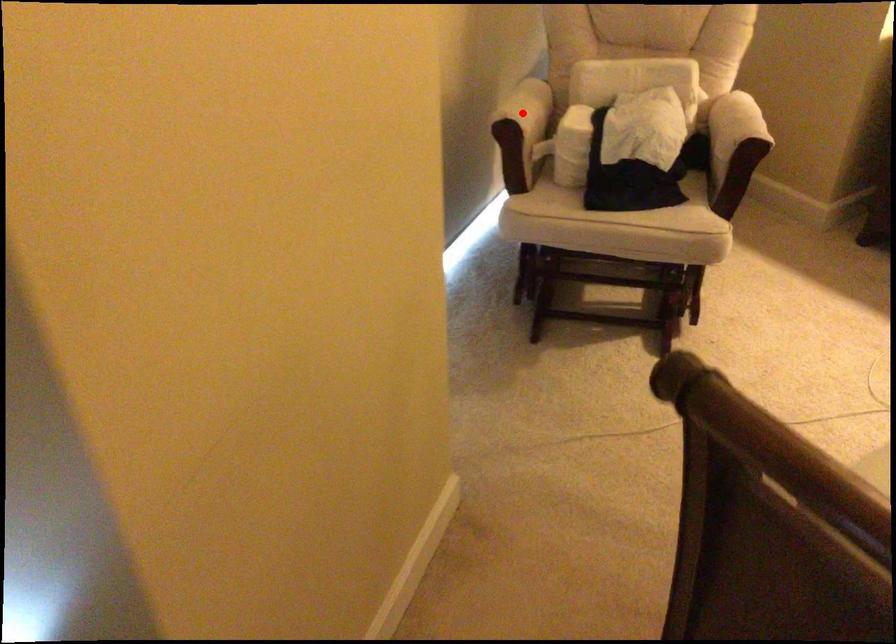
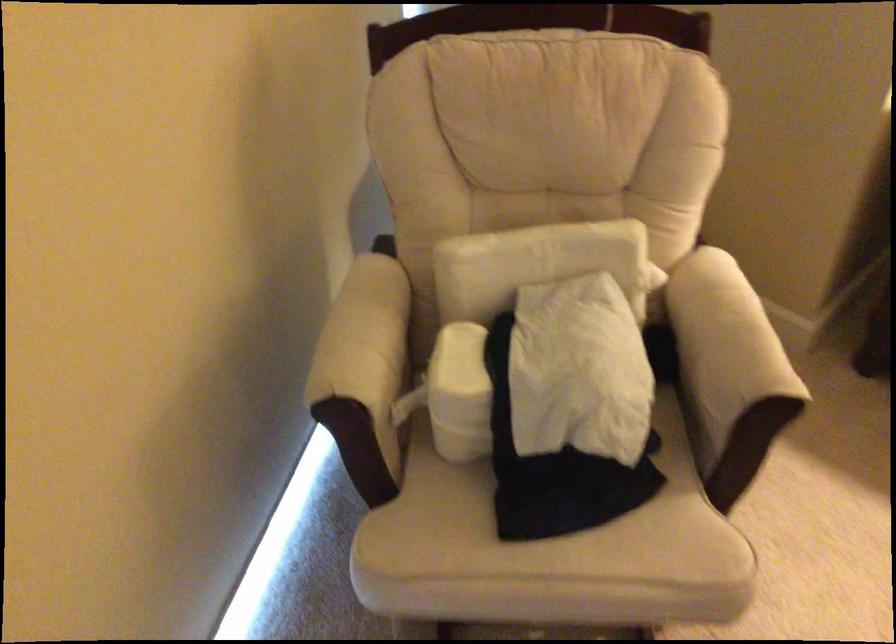
Question: I am providing you with two images of the same scene from different viewpoints. Image1 has a red point marked. In image2, the corresponding 3D location appears at what relative position? Reply with the corresponding letter.

Choices:
 (A) Closer
 (B) Farther

Answer: (A)